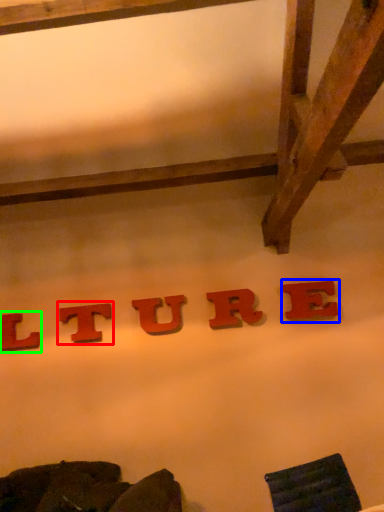
Question: Based on their relative distances, which object is farther from letter (highlighted by a red box)? Choose from letter (highlighted by a blue box) and letter (highlighted by a green box).

Choices:
 (A) letter
 (B) letter

Answer: (A)